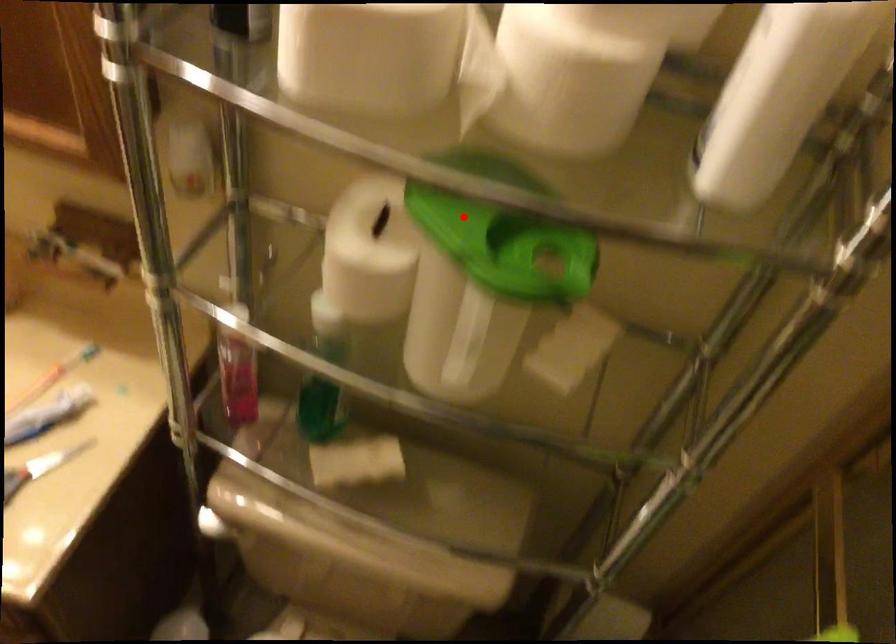
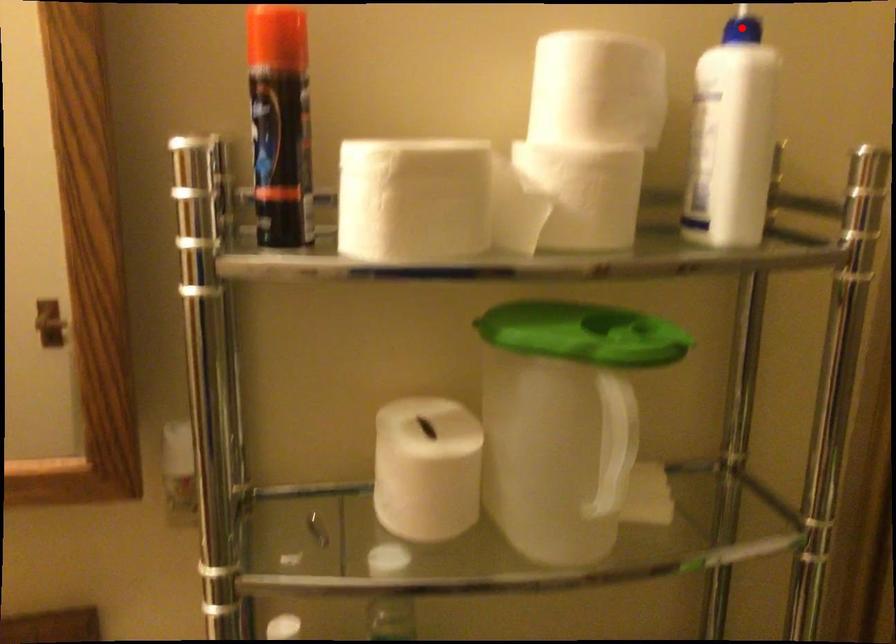
I am providing you with two images of the same scene from different viewpoints. A red point is marked on the first image and another point is marked on the second image. Is the marked point in image1 the same physical position as the marked point in image2?

No